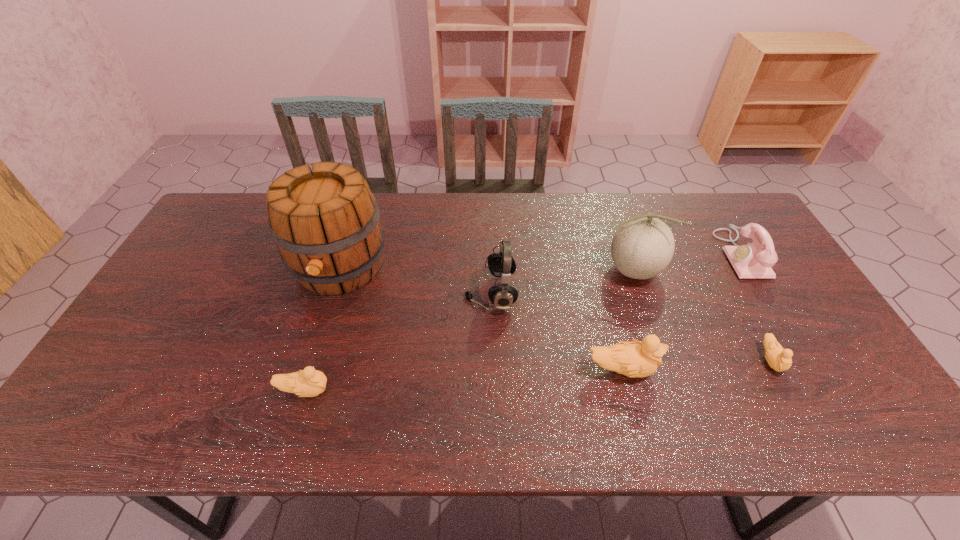
Where is `blank space at the near left corner of the desktop`? The image size is (960, 540). blank space at the near left corner of the desktop is located at coordinates (155, 372).

Find the location of a particular element. The image size is (960, 540). free spot between the rightmost object and the shortest object is located at coordinates (756, 307).

At what (x,y) coordinates should I click in order to perform the action: click on free space between the rightmost object and the second shortest duckling. Please return your answer as a coordinate pair (x, y). The width and height of the screenshot is (960, 540). Looking at the image, I should click on (523, 322).

Where is `vacant space in between the tallest duckling and the third object from left to right`? The width and height of the screenshot is (960, 540). vacant space in between the tallest duckling and the third object from left to right is located at coordinates (556, 332).

Image resolution: width=960 pixels, height=540 pixels. Find the location of `free area in between the tallest object and the second shortest object`. free area in between the tallest object and the second shortest object is located at coordinates (323, 329).

At what (x,y) coordinates should I click in order to perform the action: click on free space between the cantaloup and the headset. Please return your answer as a coordinate pair (x, y). Looking at the image, I should click on (562, 282).

Locate an element on the screen. The image size is (960, 540). unoccupied area between the cantaloup and the second tallest duckling is located at coordinates pyautogui.click(x=468, y=330).

In order to click on vacant area that lies between the leftmost duckling and the second duckling from right to left in this screenshot , I will do `click(463, 380)`.

At what (x,y) coordinates should I click in order to perform the action: click on free space between the cider and the tallest duckling. Please return your answer as a coordinate pair (x, y). This screenshot has width=960, height=540. Looking at the image, I should click on click(480, 319).

In order to click on vacant area that lies between the sixth object from left to right and the tallest object in this screenshot , I will do `click(555, 314)`.